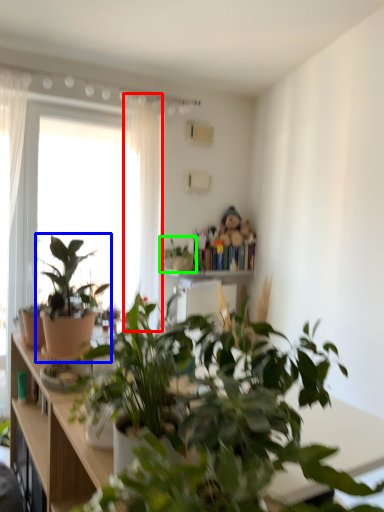
Question: Based on their relative distances, which object is farther from curtain (highlighted by a red box)? Choose from houseplant (highlighted by a blue box) and houseplant (highlighted by a green box).

Choices:
 (A) houseplant
 (B) houseplant

Answer: (A)